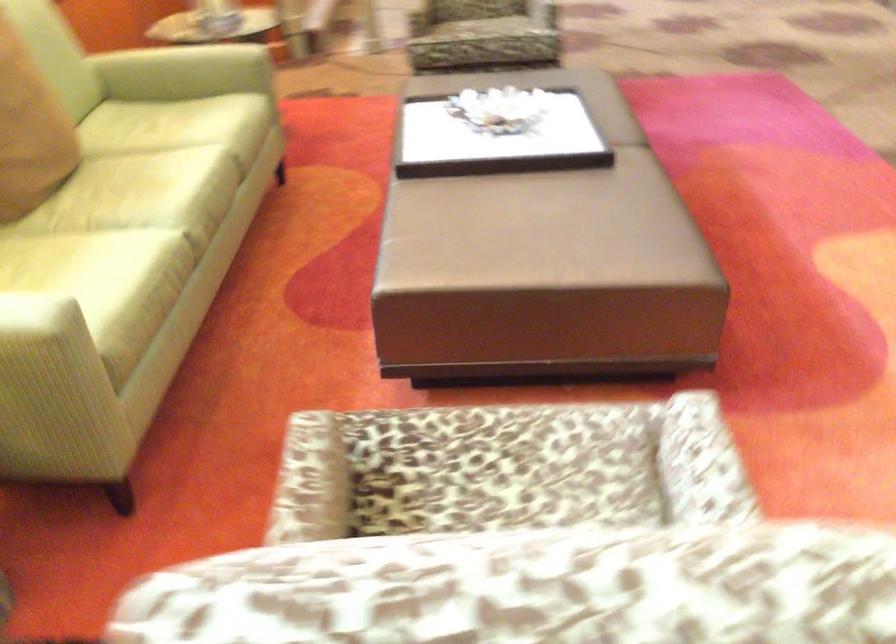
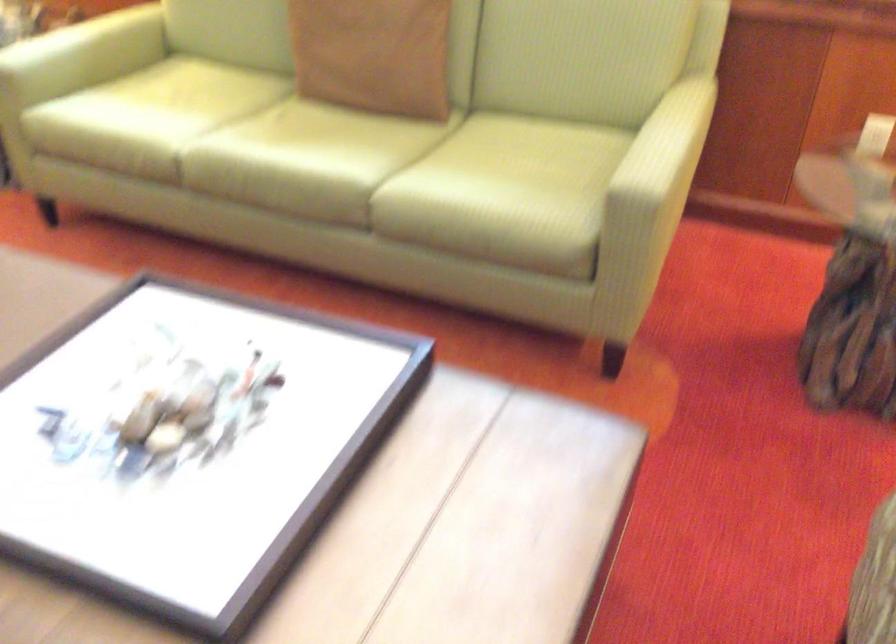
In the second image, find the point that corresponds to the point at 218,120 in the first image.

(429, 182)